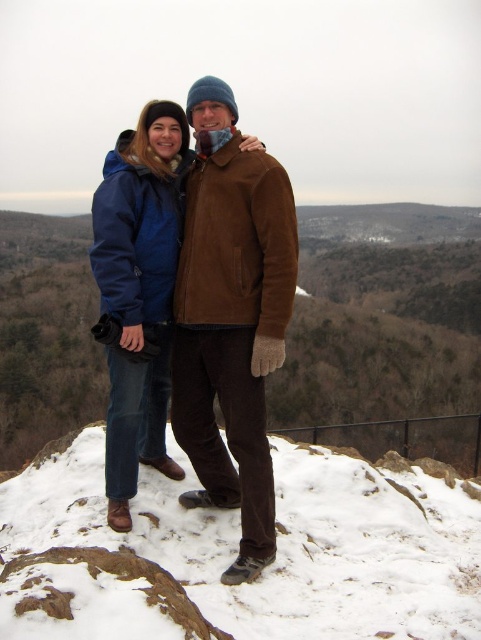
Question: Which object is closer to the camera taking this photo?

Choices:
 (A) white powdery snow at center
 (B) brown suede jacket at center

Answer: (A)

Question: Is white powdery snow at center to the right of brown suede jacket at center from the viewer's perspective?

Choices:
 (A) yes
 (B) no

Answer: (A)

Question: Does white powdery snow at center have a smaller size compared to brown suede jacket at center?

Choices:
 (A) no
 (B) yes

Answer: (A)

Question: Which point appears closest to the camera in this image?

Choices:
 (A) (480, 634)
 (B) (242, 385)

Answer: (A)

Question: Which point appears closest to the camera in this image?

Choices:
 (A) (172, 582)
 (B) (260, 561)

Answer: (A)

Question: Does white powdery snow at center have a smaller size compared to brown suede jacket at center?

Choices:
 (A) yes
 (B) no

Answer: (B)